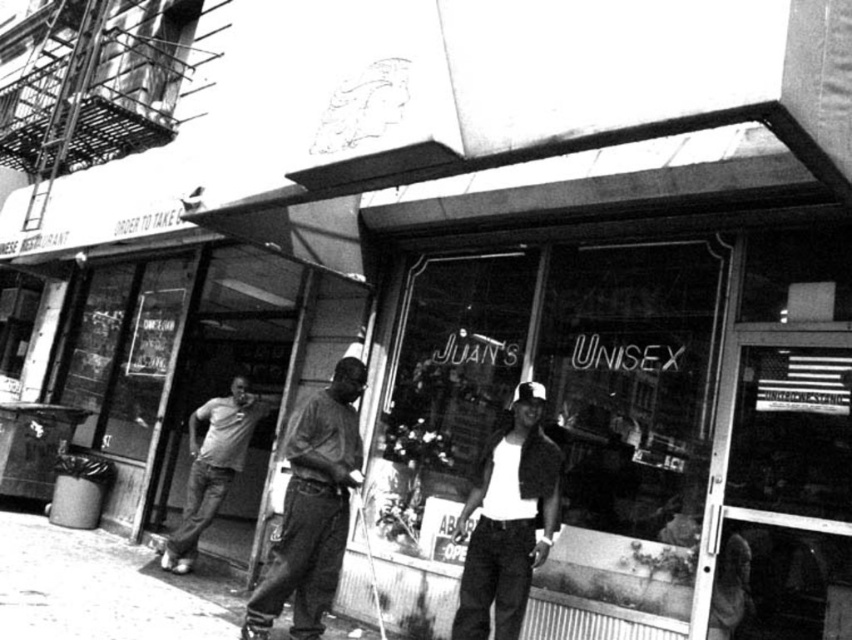
Question: Which point is closer to the camera?

Choices:
 (A) light gray t-shirt at center
 (B) transparent glass window at center

Answer: (B)

Question: Does transparent glass window at center appear on the left side of white matte shirt at center?

Choices:
 (A) no
 (B) yes

Answer: (A)

Question: Where is transparent glass window at center located in relation to white matte shirt at center in the image?

Choices:
 (A) left
 (B) right

Answer: (B)

Question: Among these objects, which one is nearest to the camera?

Choices:
 (A) dark gray jeans at center
 (B) light gray t-shirt at center
 (C) white matte shirt at center

Answer: (C)

Question: Does transparent glass window at center have a lesser width compared to dark gray jeans at center?

Choices:
 (A) yes
 (B) no

Answer: (B)

Question: Which object is farther from the camera taking this photo?

Choices:
 (A) transparent glass window at center
 (B) dark gray jeans at center
 (C) light gray t-shirt at center

Answer: (C)